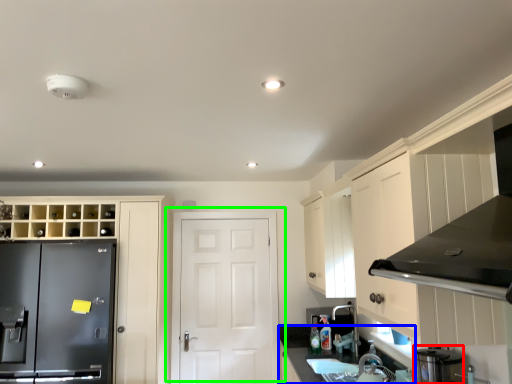
Question: Based on their relative distances, which object is nearer to appliance (highlighted by a red box)? Choose from counter top (highlighted by a blue box) and door (highlighted by a green box).

Choices:
 (A) counter top
 (B) door

Answer: (A)